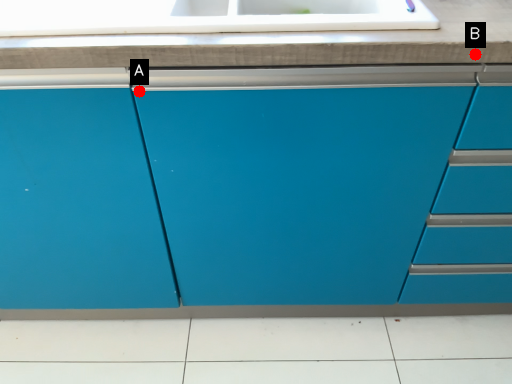
Question: Two points are circled on the image, labeled by A and B beside each circle. Which point appears farthest from the camera in this image?

Choices:
 (A) A is further
 (B) B is further

Answer: (A)